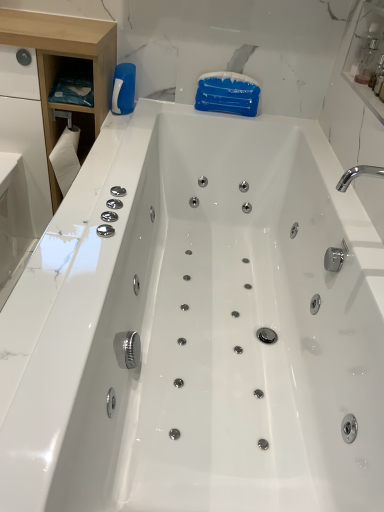
This screenshot has height=512, width=384. I want to click on vacant space behind white plastic bottle at upper left, so click(x=140, y=101).